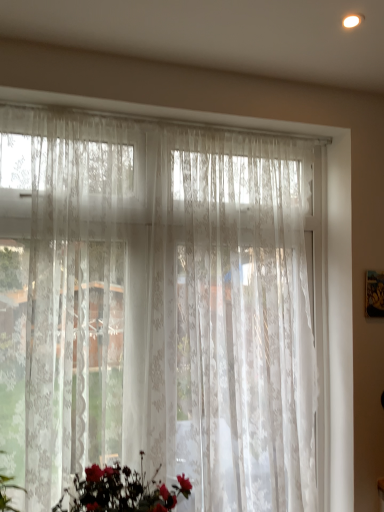
Locate an element on the screen. The image size is (384, 512). translucent floral-patterned curtain at center is located at coordinates click(x=156, y=309).

Image resolution: width=384 pixels, height=512 pixels. Describe the element at coordinates (156, 309) in the screenshot. I see `translucent floral-patterned curtain at center` at that location.

In order to face silky white bouquet at lower center, should I rotate leftwards or rightwards?

Rotate left and turn 9.562 degrees.

This screenshot has height=512, width=384. Describe the element at coordinates (122, 490) in the screenshot. I see `silky white bouquet at lower center` at that location.

Identify the location of silky white bouquet at lower center. (122, 490).

Measure the distance between silky white bouquet at lower center and camera.

silky white bouquet at lower center and camera are 1.22 meters apart from each other.

In order to click on translucent floral-patterned curtain at center in this screenshot , I will do `click(156, 309)`.

Considering the relative positions of translucent floral-patterned curtain at center and silky white bouquet at lower center in the image provided, is translucent floral-patterned curtain at center to the left of silky white bouquet at lower center from the viewer's perspective?

Incorrect, translucent floral-patterned curtain at center is not on the left side of silky white bouquet at lower center.

Which object is further away from the camera taking this photo, translucent floral-patterned curtain at center or silky white bouquet at lower center?

translucent floral-patterned curtain at center is further from the camera.

Does point (240, 424) lie behind point (141, 500)?

Yes.

From the image's perspective, is translucent floral-patterned curtain at center above or below silky white bouquet at lower center?

Based on their image positions, translucent floral-patterned curtain at center is located above silky white bouquet at lower center.

From a real-world perspective, which is physically above, translucent floral-patterned curtain at center or silky white bouquet at lower center?

From a 3D spatial view, translucent floral-patterned curtain at center is above.

Considering the relative sizes of translucent floral-patterned curtain at center and silky white bouquet at lower center in the image provided, is translucent floral-patterned curtain at center thinner than silky white bouquet at lower center?

Indeed, translucent floral-patterned curtain at center has a lesser width compared to silky white bouquet at lower center.

Considering the relative sizes of translucent floral-patterned curtain at center and silky white bouquet at lower center in the image provided, is translucent floral-patterned curtain at center taller than silky white bouquet at lower center?

Indeed, translucent floral-patterned curtain at center has a greater height compared to silky white bouquet at lower center.

Considering the sizes of translucent floral-patterned curtain at center and silky white bouquet at lower center in the image, is translucent floral-patterned curtain at center bigger or smaller than silky white bouquet at lower center?

translucent floral-patterned curtain at center is bigger than silky white bouquet at lower center.

Which is correct: translucent floral-patterned curtain at center is inside silky white bouquet at lower center, or outside of it?

translucent floral-patterned curtain at center is not inside silky white bouquet at lower center, it's outside.

Is there a large distance between translucent floral-patterned curtain at center and silky white bouquet at lower center?

That's not correct — translucent floral-patterned curtain at center is a little close to silky white bouquet at lower center.

Is translucent floral-patterned curtain at center facing away from silky white bouquet at lower center?

Correct, translucent floral-patterned curtain at center is looking away from silky white bouquet at lower center.

Can you tell me how much translucent floral-patterned curtain at center and silky white bouquet at lower center differ in facing direction?

The angle between the facing direction of translucent floral-patterned curtain at center and the facing direction of silky white bouquet at lower center is 1.63 degrees.

Image resolution: width=384 pixels, height=512 pixels. In order to click on curtain behind the silky white bouquet at lower center in this screenshot , I will do (x=156, y=309).

Considering the positions of objects silky white bouquet at lower center and translucent floral-patterned curtain at center in the image provided, who is more to the left, silky white bouquet at lower center or translucent floral-patterned curtain at center?

Positioned to the left is silky white bouquet at lower center.

Is silky white bouquet at lower center further to camera compared to translucent floral-patterned curtain at center?

No, it is in front of translucent floral-patterned curtain at center.

Does point (94, 477) come in front of point (202, 319)?

Yes.

From the image's perspective, which object appears higher, silky white bouquet at lower center or translucent floral-patterned curtain at center?

translucent floral-patterned curtain at center appears higher in the image.

From a real-world perspective, is silky white bouquet at lower center above or below translucent floral-patterned curtain at center?

From a real-world perspective, silky white bouquet at lower center is physically below translucent floral-patterned curtain at center.

Can you confirm if silky white bouquet at lower center is thinner than translucent floral-patterned curtain at center?

No.

Who is shorter, silky white bouquet at lower center or translucent floral-patterned curtain at center?

silky white bouquet at lower center.

Can you confirm if silky white bouquet at lower center is bigger than translucent floral-patterned curtain at center?

Incorrect, silky white bouquet at lower center is not larger than translucent floral-patterned curtain at center.

Is translucent floral-patterned curtain at center inside silky white bouquet at lower center?

No, silky white bouquet at lower center does not contain translucent floral-patterned curtain at center.

Are silky white bouquet at lower center and translucent floral-patterned curtain at center far apart?

Actually, silky white bouquet at lower center and translucent floral-patterned curtain at center are a little close together.

Is silky white bouquet at lower center positioned with its back to translucent floral-patterned curtain at center?

Yes, silky white bouquet at lower center's orientation is away from translucent floral-patterned curtain at center.

The image size is (384, 512). I want to click on floral arrangement beneath the translucent floral-patterned curtain at center (from a real-world perspective), so click(x=122, y=490).

You are a GUI agent. You are given a task and a screenshot of the screen. Output one action in this format:
    pyautogui.click(x=<x>, y=<y>)
    Task: Click on the curtain to the right of silky white bouquet at lower center
    The width and height of the screenshot is (384, 512).
    Given the screenshot: What is the action you would take?
    pyautogui.click(x=156, y=309)

This screenshot has width=384, height=512. In order to click on curtain that appears above the silky white bouquet at lower center (from the image's perspective) in this screenshot , I will do `click(156, 309)`.